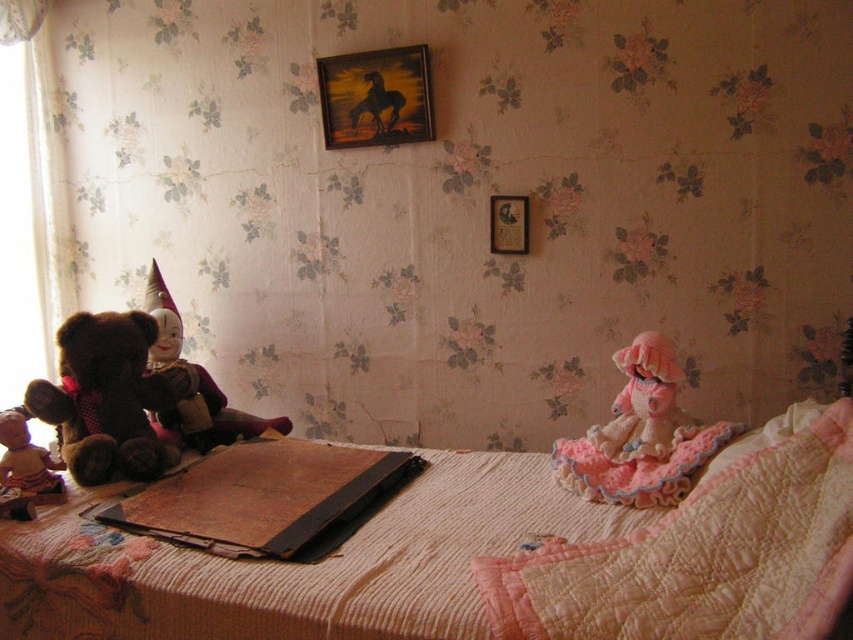
You are a child trying to decide which doll to take to the park. Both the pink crocheted doll at right and the knitted pink doll at right are on the bed. Which one is bigger?

The pink crocheted doll at right is larger in size than the knitted pink doll at right, so the pink crocheted doll at right is bigger.

You are a child trying to reach both the pink crocheted doll at right and the wooden picture frame at upper center from your current position. Which object is closer to you?

The wooden picture frame at upper center is closer to you than the pink crocheted doll at right since they are 26.12 inches apart.

You are a child trying to reach both the pink crocheted doll at right and the knitted pink doll at right from your bed. Which doll can you grab first without moving your position?

The pink crocheted doll at right is closer to the viewer, so you can grab it first without moving.